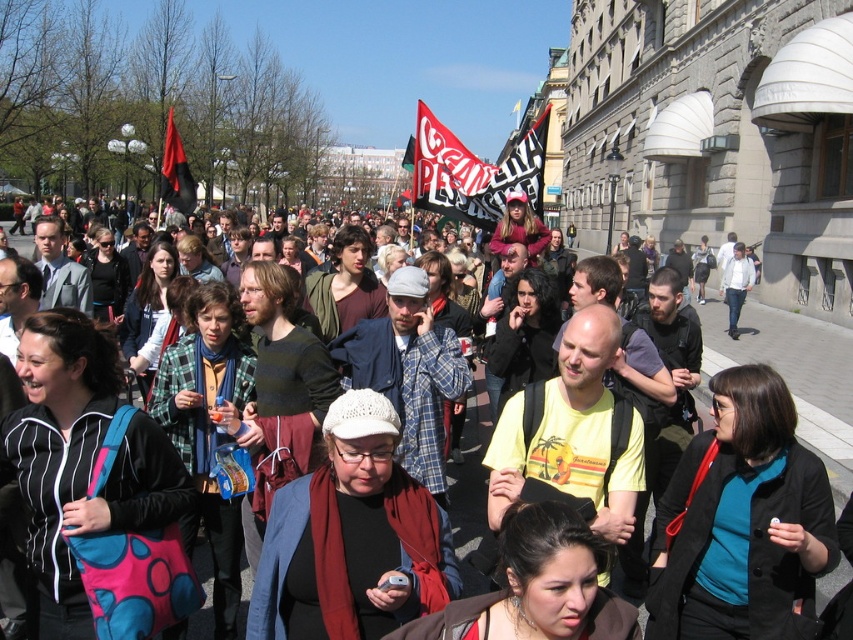
You are a photographer trying to capture both the red and white fabric flag at center and the black fabric flag at upper left in a single shot. Based on their positions, which flag should you adjust your camera to focus on first to ensure both are in the frame?

The red and white fabric flag at center is positioned on the right side of the black fabric flag at upper left. To capture both in a single shot, focus on the black fabric flag at upper left first, as it is closer to the left edge, allowing you to frame the red and white flag to its right without cropping either out.

From the picture: You are a photographer standing at the edge of the crowd, holding a camera with a 50mm lens. You want to take a photo of the matte black backpack at center while also capturing the historic building on the right. Given that the backpack and the building are 25.42 meters apart, will the 50mm lens allow you to frame both subjects in the same shot?

The matte black backpack at center and the historic building on the right are 25.42 meters apart. A 50mm lens has a moderate field of view, but whether both can fit depends on your distance from the backpack. If you are close enough to the backpack, the lens might capture both, but at greater distances, the building might be too far away. Adjust your position to include both subjects within the frame.

Based on the photo, you are a photographer trying to capture the historic building on the right side of the street. There is a matte black backpack at center blocking your view. Can you estimate how far to the left or right you need to move to avoid the backpack while still keeping the building in frame?

The matte black backpack at center is located at point (469, 474). To avoid the backpack while keeping the building in frame, you should move slightly to the left or right, ensuring the backpack is no longer in your line of sight but the building remains visible.